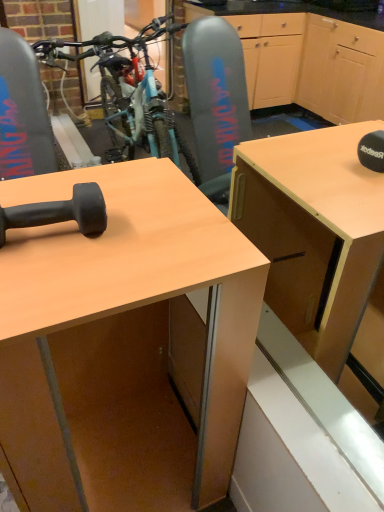
Question: Considering their positions, is matte wood desk at center located in front of or behind black rubber dumbbell at lower left?

Choices:
 (A) behind
 (B) front

Answer: (B)

Question: Considering the positions of matte wood desk at center and black rubber dumbbell at lower left in the image, is matte wood desk at center taller or shorter than black rubber dumbbell at lower left?

Choices:
 (A) tall
 (B) short

Answer: (A)

Question: Considering the positions of point (238, 354) and point (71, 206), is point (238, 354) closer or farther from the camera than point (71, 206)?

Choices:
 (A) closer
 (B) farther

Answer: (B)

Question: From their relative heights in the image, would you say black rubber dumbbell at lower left is taller or shorter than matte wood desk at center?

Choices:
 (A) tall
 (B) short

Answer: (B)

Question: Considering the positions of point (36, 214) and point (145, 499), is point (36, 214) closer or farther from the camera than point (145, 499)?

Choices:
 (A) closer
 (B) farther

Answer: (A)

Question: Is black rubber dumbbell at lower left wider or thinner than matte wood desk at center?

Choices:
 (A) thin
 (B) wide

Answer: (A)

Question: Is black rubber dumbbell at lower left inside the boundaries of matte wood desk at center, or outside?

Choices:
 (A) inside
 (B) outside

Answer: (B)